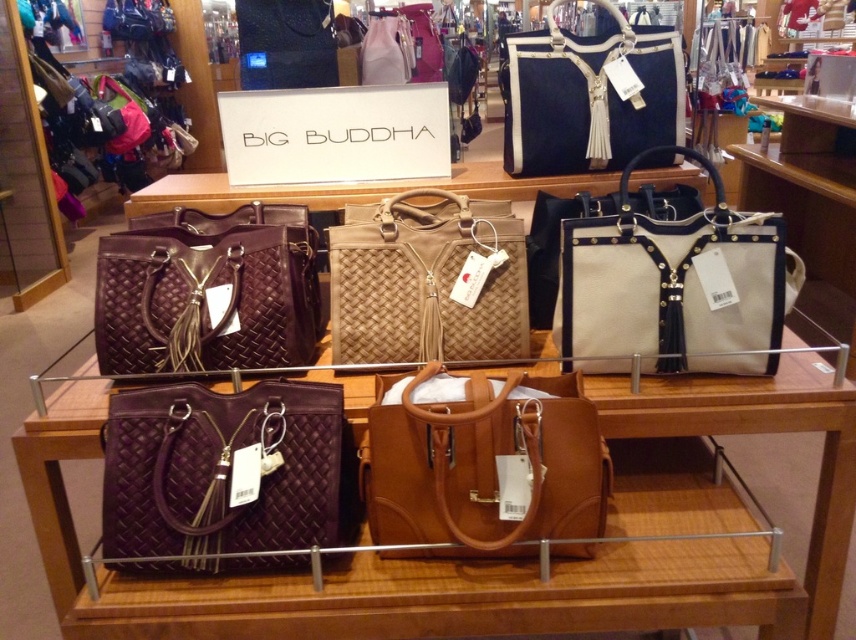
Question: Can you confirm if tan leather tote at center is thinner than matte brown woven tote at upper left?

Choices:
 (A) yes
 (B) no

Answer: (A)

Question: Considering the relative positions of tan woven tote at center and black woven tote at upper center in the image provided, where is tan woven tote at center located with respect to black woven tote at upper center?

Choices:
 (A) left
 (B) right

Answer: (A)

Question: Which point is farther from the camera taking this photo?

Choices:
 (A) (129, 289)
 (B) (602, 145)

Answer: (B)

Question: Which of the following is the closest to the observer?

Choices:
 (A) (411, 413)
 (B) (372, 26)

Answer: (A)

Question: From the image, what is the correct spatial relationship of black woven tote at upper center in relation to matte beige tote at center?

Choices:
 (A) right
 (B) left

Answer: (A)

Question: Which point is closer to the camera?

Choices:
 (A) 205,392
 (B) 221,349
 (C) 601,477
 (D) 742,352

Answer: (C)